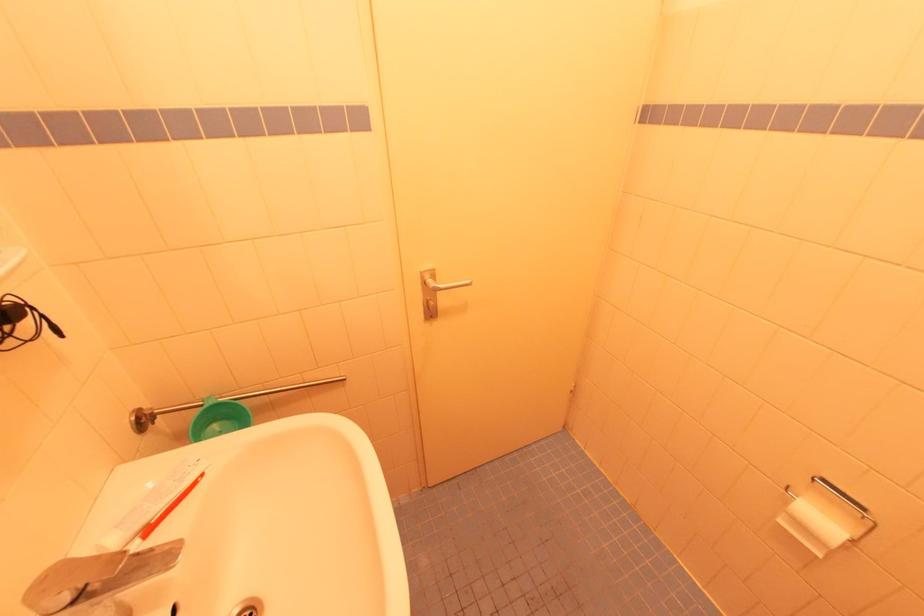
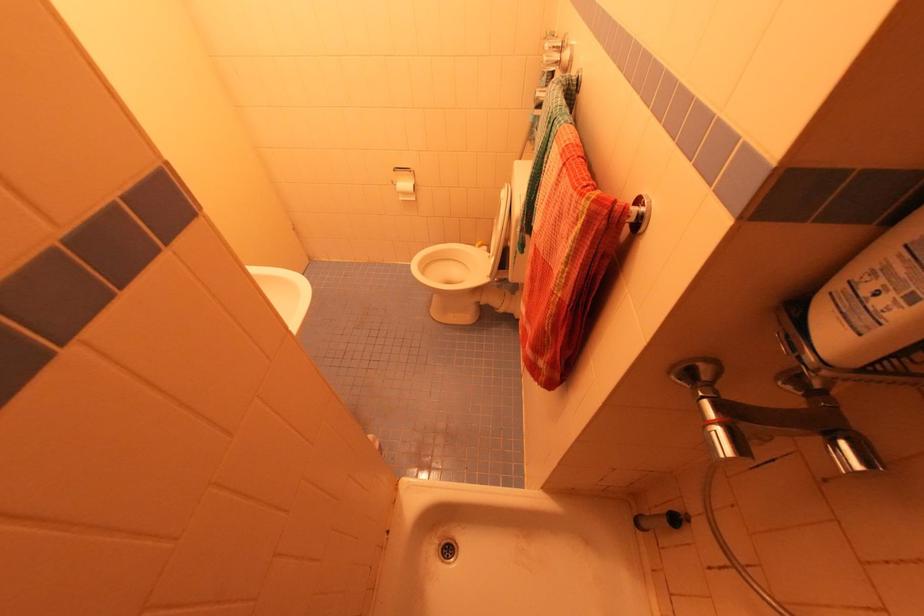
The point at [784,523] is marked in the first image. Where is the corresponding point in the second image?

(403, 200)